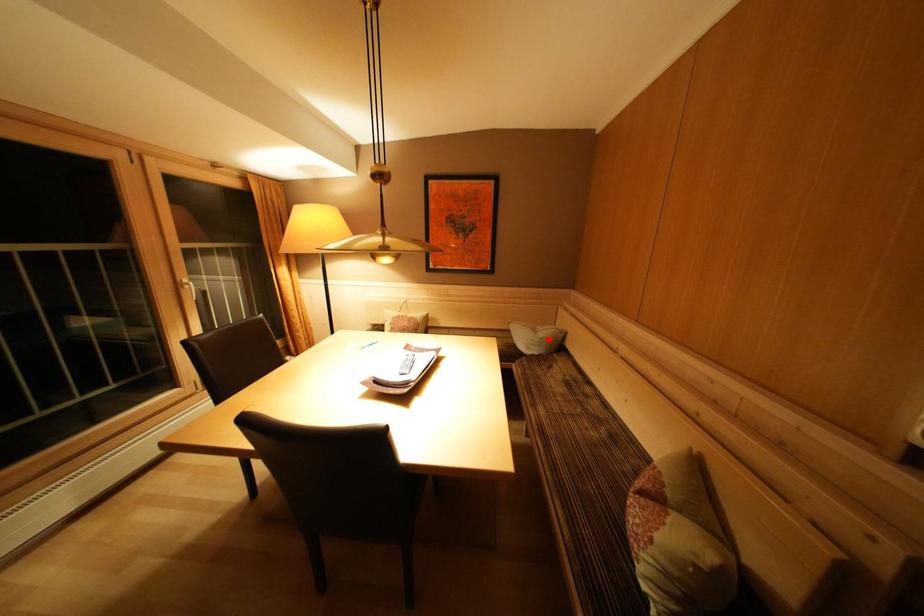
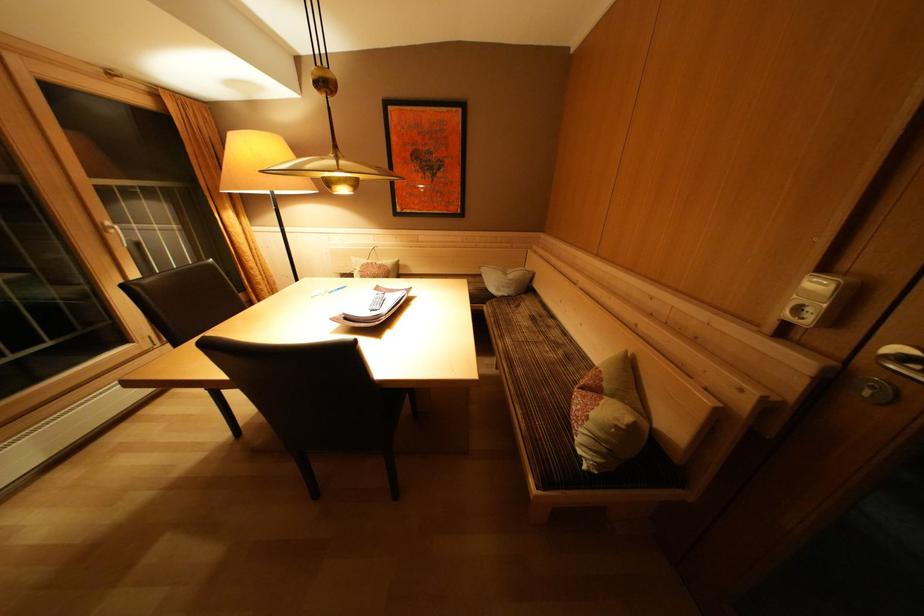
Question: I am providing you with two images of the same scene from different viewpoints. Image1 has a red point marked. In image2, the corresponding 3D location appears at what relative position? Reply with the corresponding letter.

Choices:
 (A) Closer
 (B) Farther

Answer: (A)